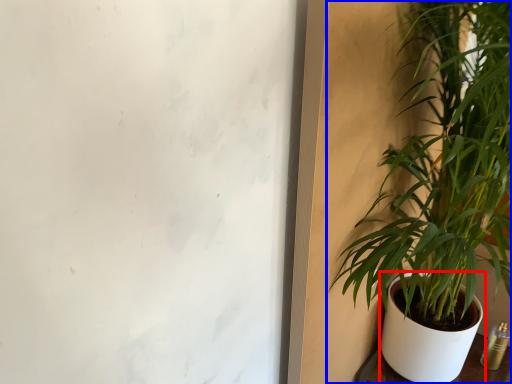
Question: Which point is further to the camera, flowerpot (highlighted by a red box) or houseplant (highlighted by a blue box)?

Choices:
 (A) flowerpot
 (B) houseplant

Answer: (A)